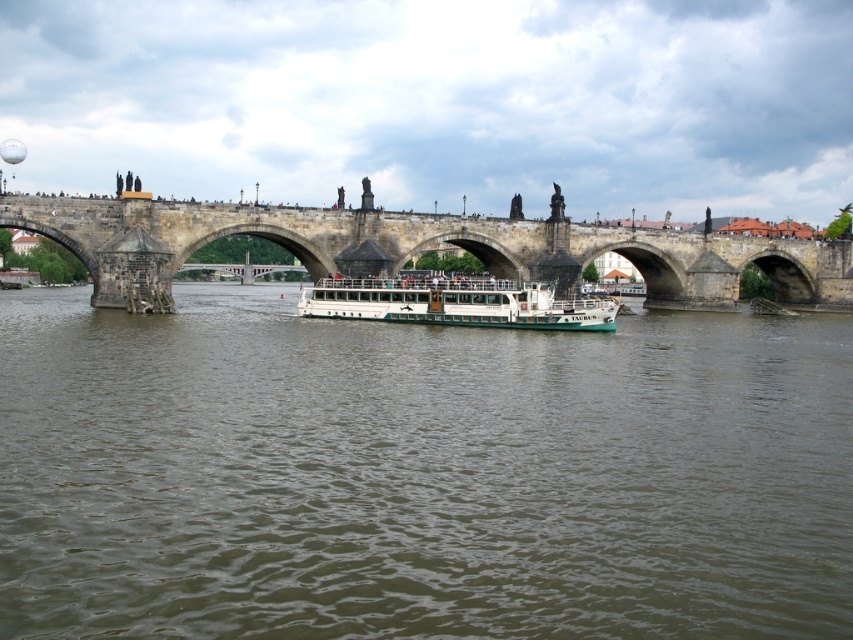
From the picture: You are a tourist standing on the riverbank and want to take a photo of the stone bridge at center and the brown water at center. Which object will appear larger in your photo?

The brown water at center will appear larger in the photo because it is much taller than the stone bridge at center.

You are a passenger on the white matte boat at center. You look around and see the brown water at center. Which object is higher in elevation?

The brown water at center is much taller than the white matte boat at center, so the brown water at center is higher in elevation.